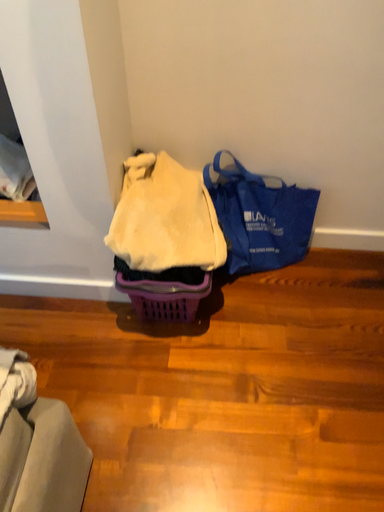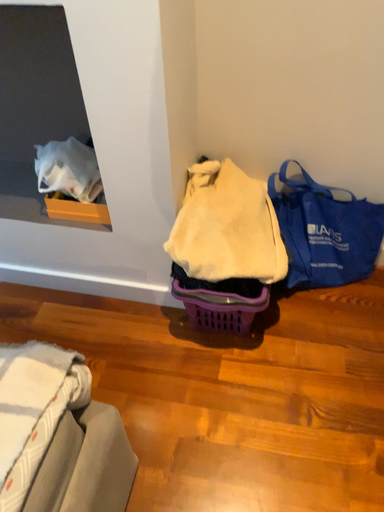
Question: How did the camera likely rotate when shooting the video?

Choices:
 (A) rotated left
 (B) rotated right

Answer: (A)